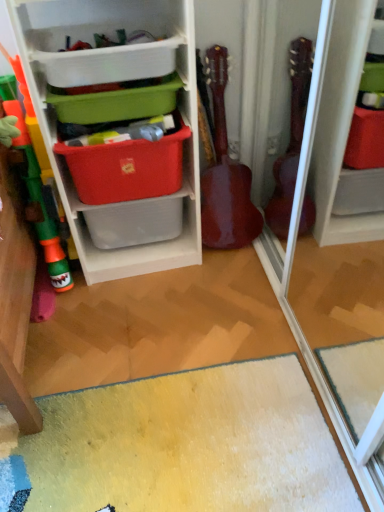
This screenshot has height=512, width=384. In order to click on vacant area that lies between plastic storage at left and glossy wood guitar at center in this screenshot , I will do `click(222, 258)`.